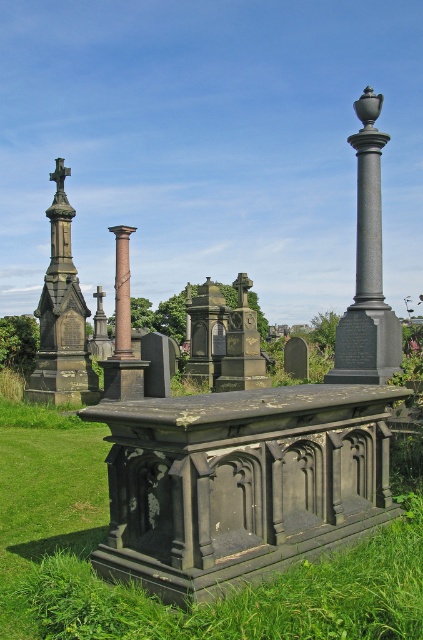
You are standing in the cemetery and want to take a photo of the dark gray stone cross at left. If your camera has a maximum focus range of 50 feet, will you be able to capture the cross clearly?

The dark gray stone cross at left is 49.10 feet from viewer, so yes, the camera can focus on it clearly since it is within the 50 feet range.

You are standing in the cemetery and want to find the dark gray stone cross at left. From the smooth gray column at center, which direction should you look to find it?

The dark gray stone cross at left is to the left of the smooth gray column at center, so you should look to your left from the smooth gray column at center to find it.

You are standing at the entrance of the cemetery and want to locate the smooth gray column at center. According to the coordinates provided, where would you find it in relation to the entrance?

The smooth gray column at center is located at coordinates point (368, 269), which places it in the central area of the cemetery, likely towards the rear from the entrance.